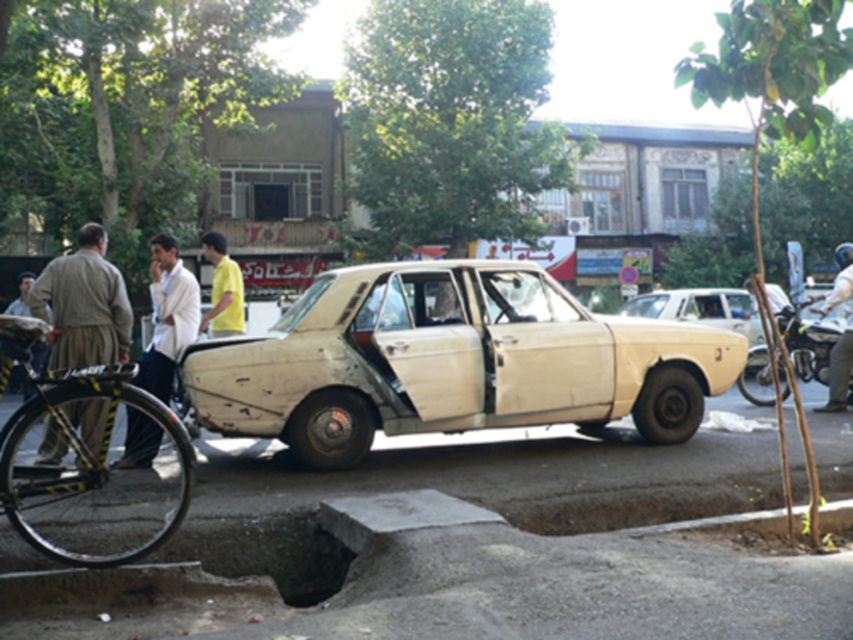
Who is shorter, white matte sedan at center or light beige shirt at center?

white matte sedan at center is shorter.

Between point (738, 310) and point (848, 349), which one is positioned behind?

The point (738, 310) is more distant.

At what (x,y) coordinates should I click in order to perform the action: click on white matte sedan at center. Please return your answer as a coordinate pair (x, y). The height and width of the screenshot is (640, 853). Looking at the image, I should click on (701, 308).

Is point (799, 358) positioned in front of point (727, 301)?

That is True.

Which is behind, point (786, 312) or point (717, 294)?

Positioned behind is point (717, 294).

You are a GUI agent. You are given a task and a screenshot of the screen. Output one action in this format:
    pyautogui.click(x=<x>, y=<y>)
    Task: Click on the metallic silver motorcycle at right
    
    Given the screenshot: What is the action you would take?
    pyautogui.click(x=805, y=342)

How far apart are white matte car at center and white matte sedan at center?

They are 34.98 feet apart.

Is white matte car at center positioned at the back of white matte sedan at center?

No, it is not.

The height and width of the screenshot is (640, 853). I want to click on white matte car at center, so click(x=451, y=362).